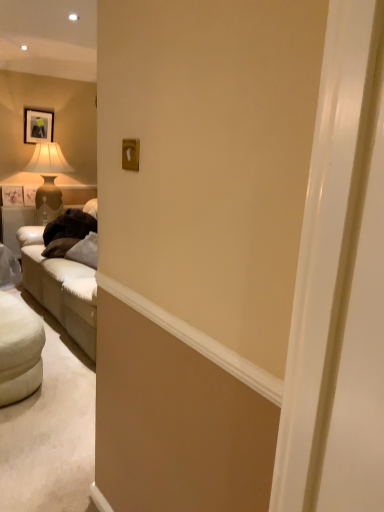
Question: In the image, is matte beige lampshade at left positioned in front of or behind white fabric ottoman at lower left?

Choices:
 (A) behind
 (B) front

Answer: (A)

Question: In terms of size, does matte beige lampshade at left appear bigger or smaller than white fabric ottoman at lower left?

Choices:
 (A) big
 (B) small

Answer: (A)

Question: Considering the real-world distances, which object is farthest from the matte beige lampshade at left?

Choices:
 (A) matte black picture frame at upper left
 (B) white fabric ottoman at lower left

Answer: (B)

Question: Considering the real-world distances, which object is farthest from the matte beige lampshade at left?

Choices:
 (A) matte black picture frame at upper left
 (B) white fabric ottoman at lower left

Answer: (B)